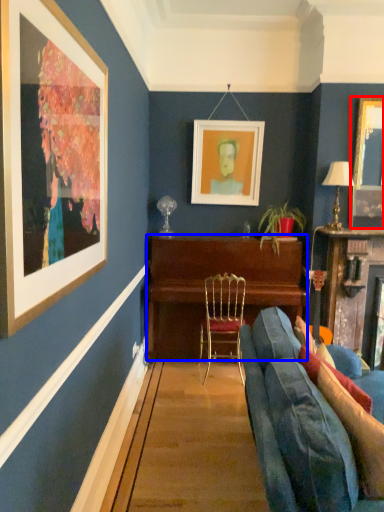
Question: Which point is closer to the camera, picture frame (highlighted by a red box) or desk (highlighted by a blue box)?

Choices:
 (A) picture frame
 (B) desk

Answer: (A)